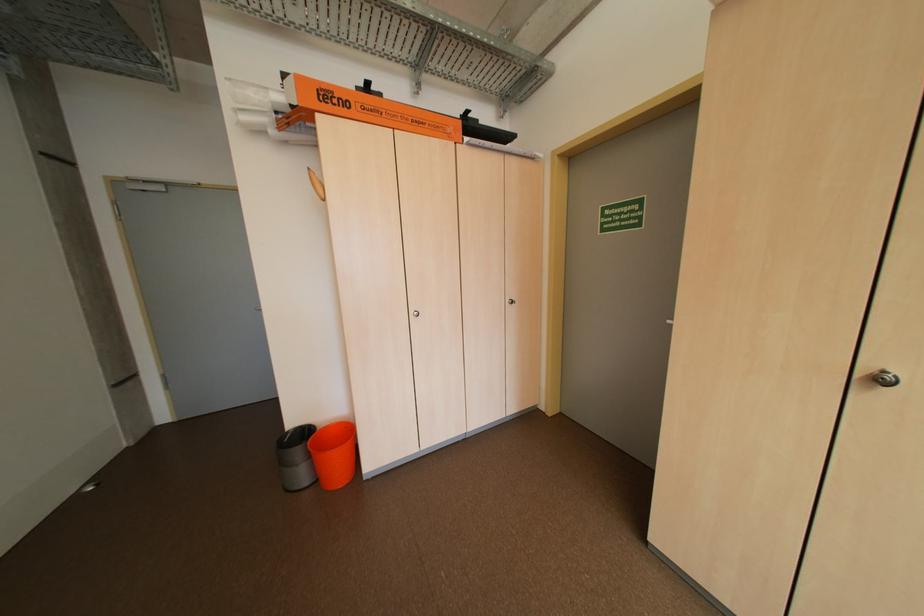
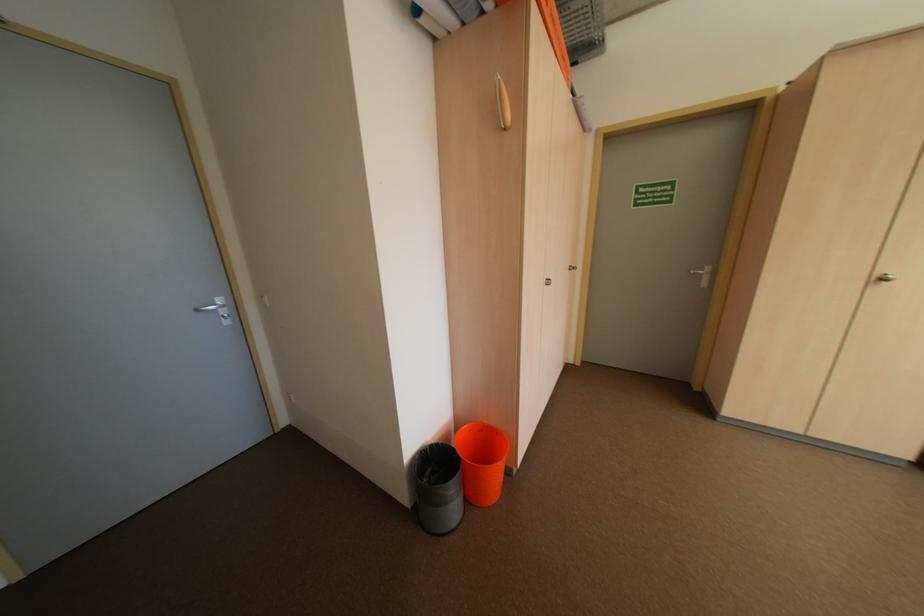
Locate, in the second image, the point that corresponds to pixel 891 381 in the first image.

(893, 281)